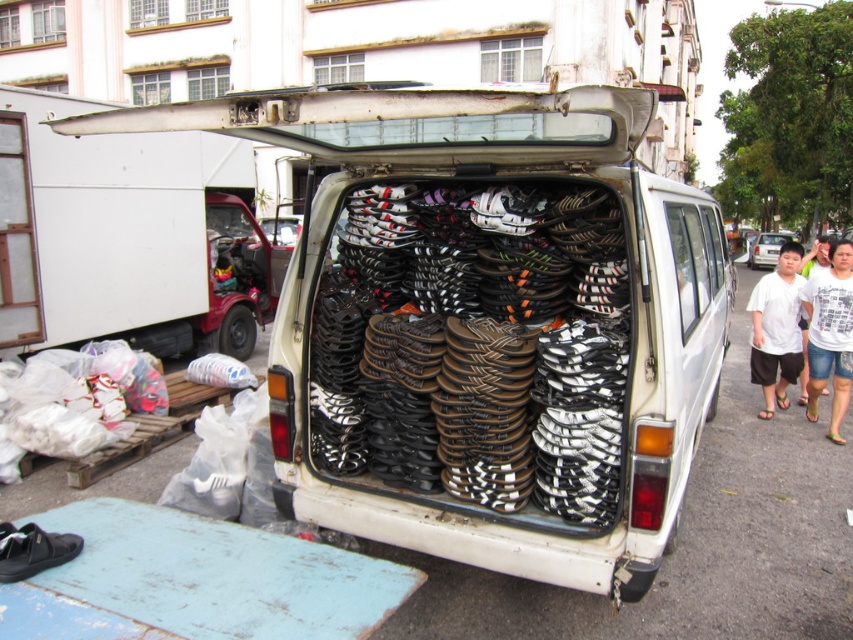
Question: From the image, what is the correct spatial relationship of black matte sandals at center in relation to black rubber tire at right?

Choices:
 (A) left
 (B) right

Answer: (A)

Question: Does black rubber sandals at center come behind black rubber tire at right?

Choices:
 (A) no
 (B) yes

Answer: (A)

Question: Which of the following is the farthest from the observer?

Choices:
 (A) (245, 348)
 (B) (764, 333)
 (C) (595, 410)

Answer: (A)

Question: Which object is closer to the camera taking this photo?

Choices:
 (A) white cotton shirt at right
 (B) white matte car at center
 (C) black rubber sandals at center
 (D) white fabric shirt at right

Answer: (C)

Question: Is black matte sandals at center to the right of white fabric shirt at right from the viewer's perspective?

Choices:
 (A) no
 (B) yes

Answer: (A)

Question: Which of the following is the farthest from the observer?

Choices:
 (A) 822,328
 (B) 399,282
 (C) 248,330
 (D) 714,408

Answer: (C)